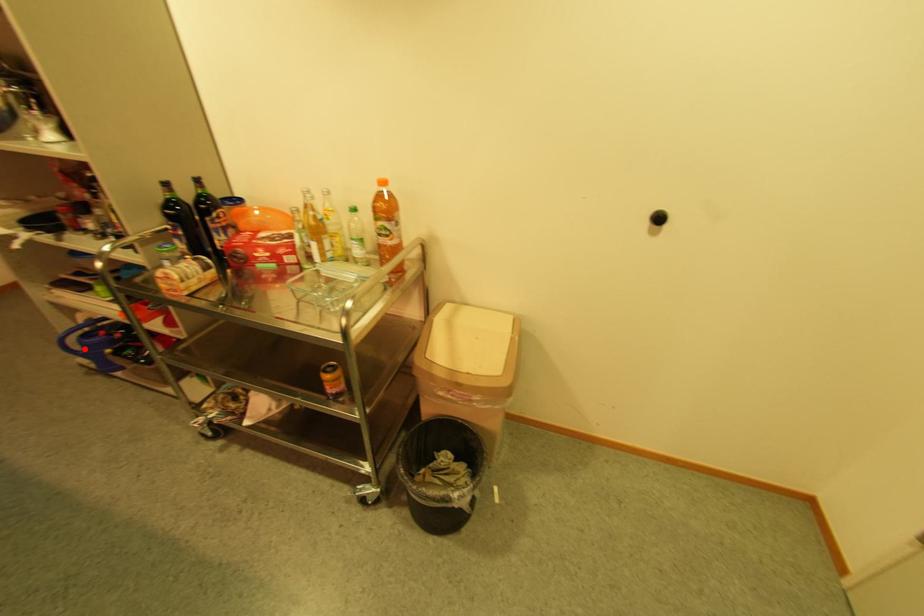
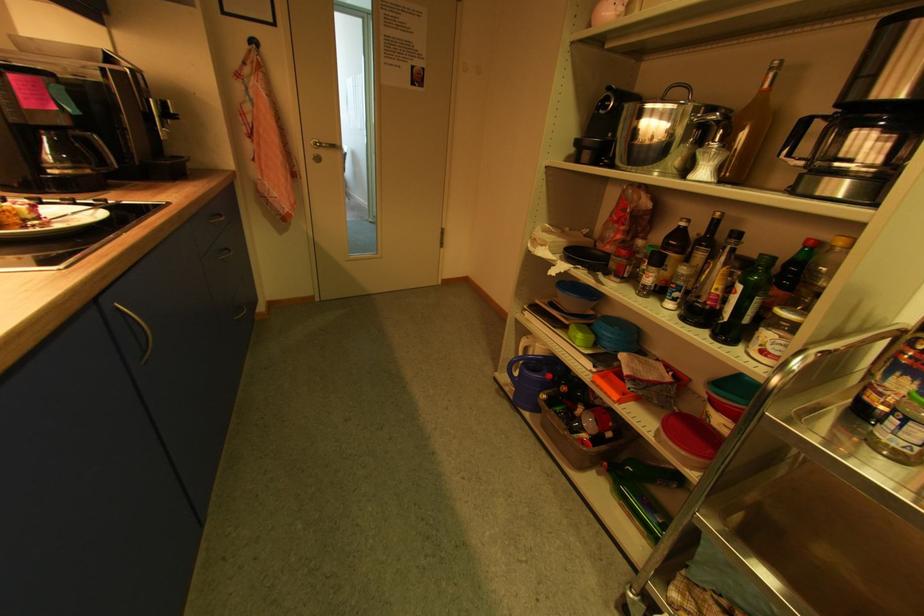
Question: I am providing you with two images of the same scene from different viewpoints. In image1, a red point is highlighted. Considering the same 3D point in image2, which of the following is correct?

Choices:
 (A) It is closer
 (B) It is farther

Answer: (B)